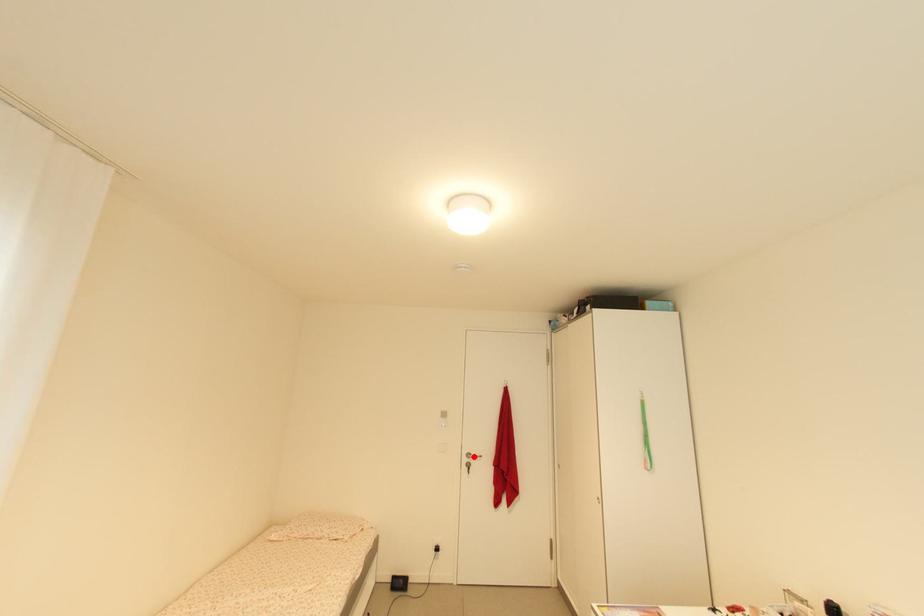
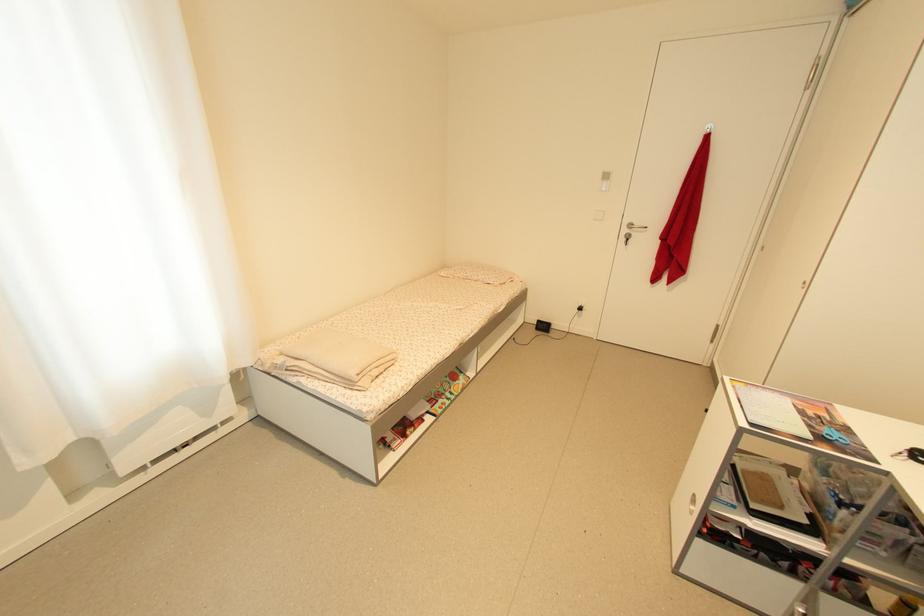
Question: I am providing you with two images of the same scene from different viewpoints. Given a red point in image1, look at the same physical point in image2. Is it:

Choices:
 (A) Closer to the viewpoint
 (B) Farther from the viewpoint

Answer: (A)